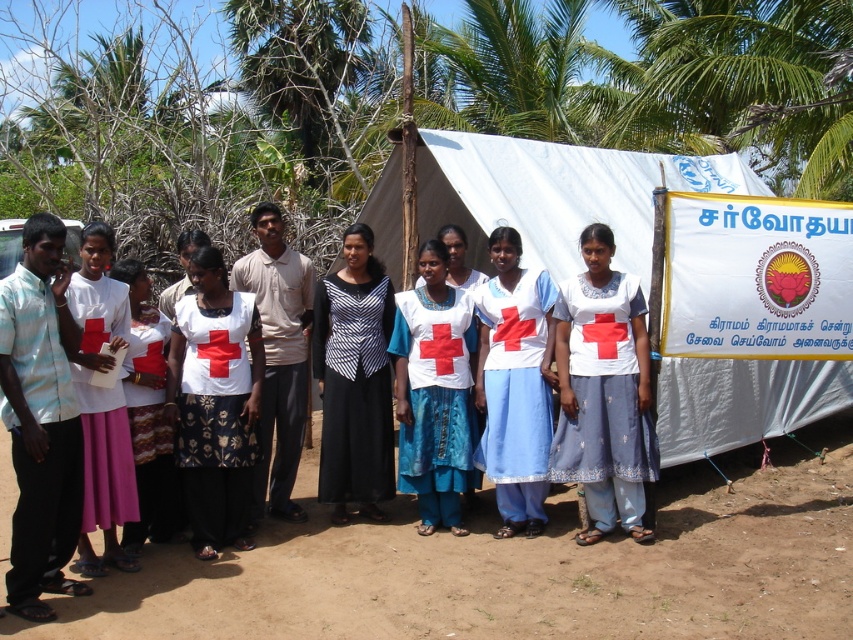
Question: Among these objects, which one is nearest to the camera?

Choices:
 (A) white cotton shirt at center
 (B) white fabric dress at center
 (C) white printed shirt at center
 (D) brown sandy ground at lower center

Answer: (D)

Question: Which point appears closest to the camera in this image?

Choices:
 (A) (527, 211)
 (B) (468, 390)

Answer: (B)

Question: Does white cotton shirt at center appear on the left side of white fabric skirt at lower left?

Choices:
 (A) no
 (B) yes

Answer: (A)

Question: Is brown sandy ground at lower center to the right of black striped dress at center from the viewer's perspective?

Choices:
 (A) no
 (B) yes

Answer: (B)

Question: Which of the following is the closest to the observer?

Choices:
 (A) (85, 451)
 (B) (198, 317)

Answer: (A)

Question: Is brown sandy ground at lower center closer to camera compared to white fabric dress at center?

Choices:
 (A) yes
 (B) no

Answer: (A)